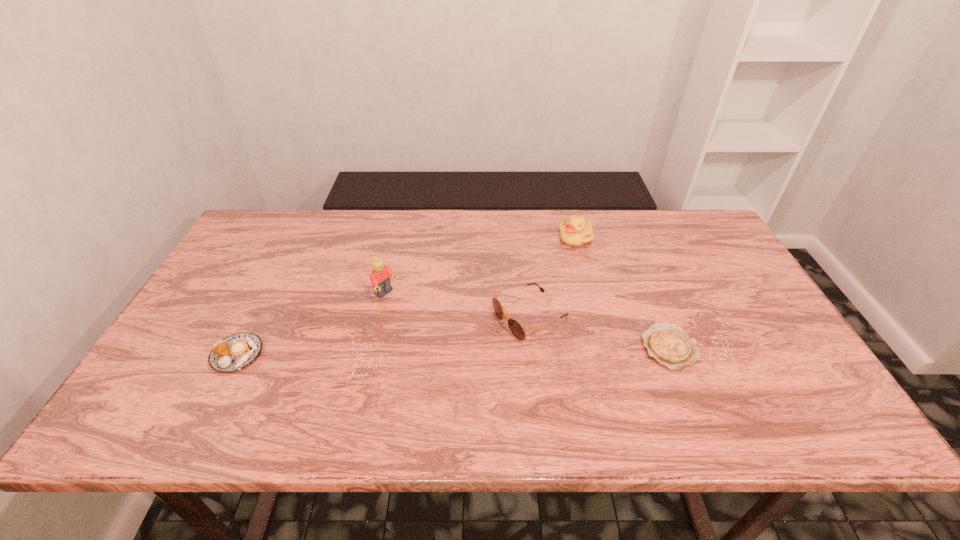
Find the location of `vacant region located 0.400m on the back of the second shortest object`. vacant region located 0.400m on the back of the second shortest object is located at coordinates (297, 240).

Find the location of a particular element. Image resolution: width=960 pixels, height=540 pixels. free space located 0.240m on the back of the shortest object is located at coordinates (636, 264).

Identify the location of vacant space located 0.360m on the lenses of the third object from left to right. (364, 396).

Where is `free location located 0.240m on the lenses of the third object from left to right`? This screenshot has width=960, height=540. free location located 0.240m on the lenses of the third object from left to right is located at coordinates (413, 372).

I want to click on vacant space located on the lenses of the third object from left to right, so click(443, 358).

Where is `vacant space situated 0.080m at the face of the farthest object`? This screenshot has width=960, height=540. vacant space situated 0.080m at the face of the farthest object is located at coordinates (561, 262).

What are the coordinates of `vacant area situated 0.250m at the face of the farthest object` in the screenshot? It's located at (538, 296).

Where is `blank area located at the face of the farthest object`? This screenshot has width=960, height=540. blank area located at the face of the farthest object is located at coordinates (516, 330).

Locate an element on the screen. The width and height of the screenshot is (960, 540). vacant area located on the face of the tallest object is located at coordinates (466, 349).

Identify the location of free space located on the face of the tallest object. The image size is (960, 540). (505, 375).